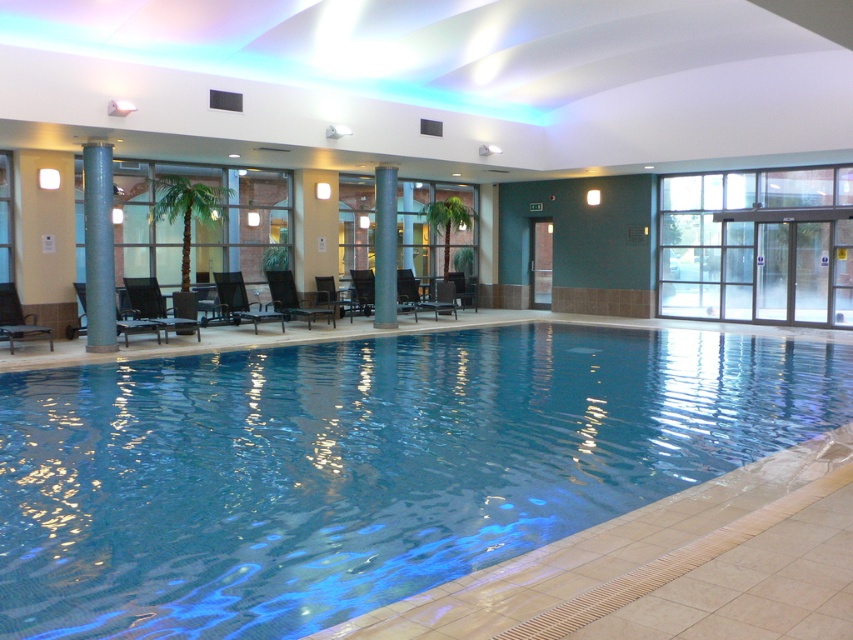
Based on the photo, is matte black lounge chair at lower left below dark brown leather chair at center?

Indeed, matte black lounge chair at lower left is positioned under dark brown leather chair at center.

At what (x,y) coordinates should I click in order to perform the action: click on matte black lounge chair at lower left. Please return your answer as a coordinate pair (x, y). This screenshot has width=853, height=640. Looking at the image, I should click on pos(16,317).

Find the location of `matte black lounge chair at lower left`. matte black lounge chair at lower left is located at coordinates (16, 317).

What are the coordinates of `matte black lounge chair at lower left` in the screenshot? It's located at (16, 317).

Is smooth gray column at center thinner than metallic silver chair at center?

Yes.

Does point (96, 250) come farther from viewer compared to point (462, 288)?

No, it is not.

The height and width of the screenshot is (640, 853). In order to click on smooth gray column at center in this screenshot , I will do `click(97, 248)`.

Does smooth gray column at center have a larger size compared to matte black chair at left?

Correct, smooth gray column at center is larger in size than matte black chair at left.

This screenshot has height=640, width=853. In order to click on smooth gray column at center in this screenshot , I will do `click(97, 248)`.

Is point (84, 256) farther from viewer compared to point (68, 337)?

Yes, point (84, 256) is behind point (68, 337).

The height and width of the screenshot is (640, 853). Find the location of `smooth gray column at center`. smooth gray column at center is located at coordinates (97, 248).